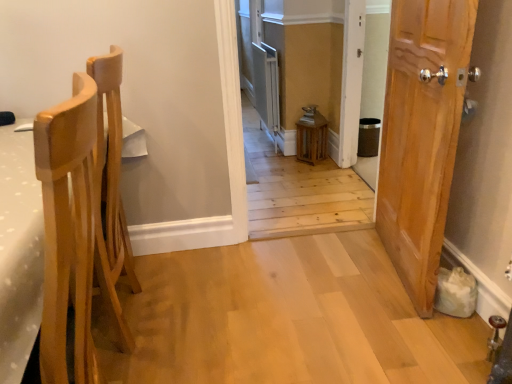
Find the location of a particular element. Image resolution: width=512 pixels, height=384 pixels. vacant area situated to the left side of wooden door at right is located at coordinates (321, 277).